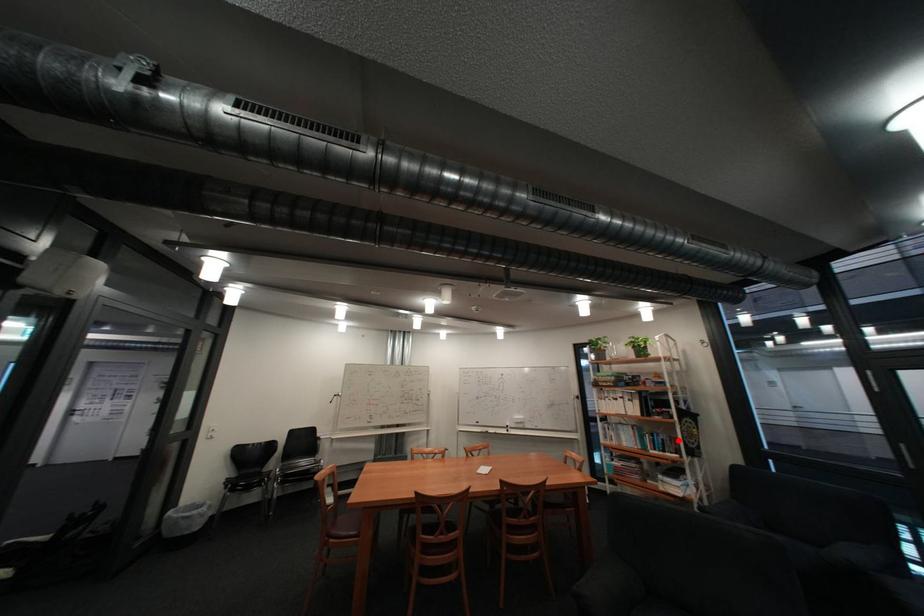
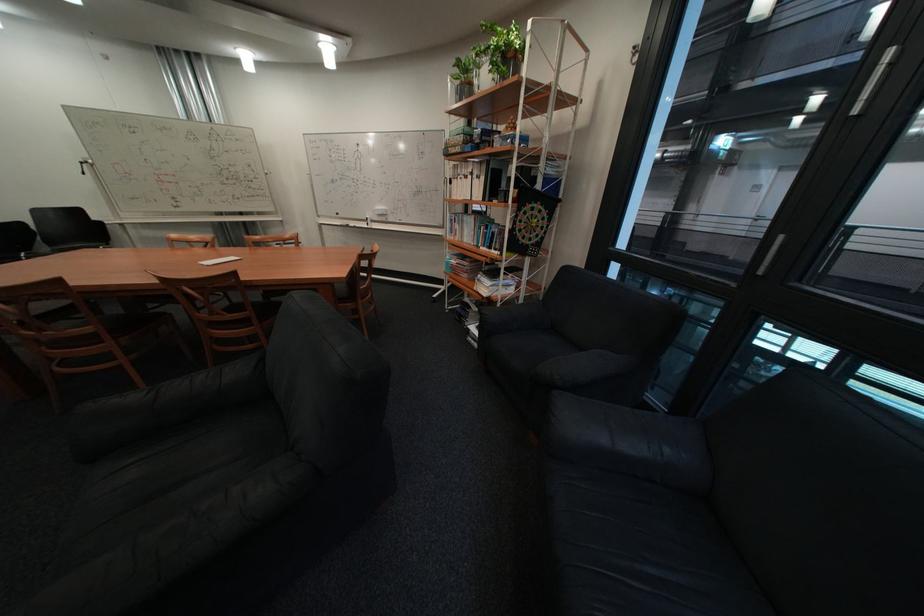
Question: A red point is marked in image1. In image2, is the corresponding 3D point closer to the camera or farther? Reply with the corresponding letter.

Choices:
 (A) The corresponding 3D point is closer.
 (B) The corresponding 3D point is farther.

Answer: (A)